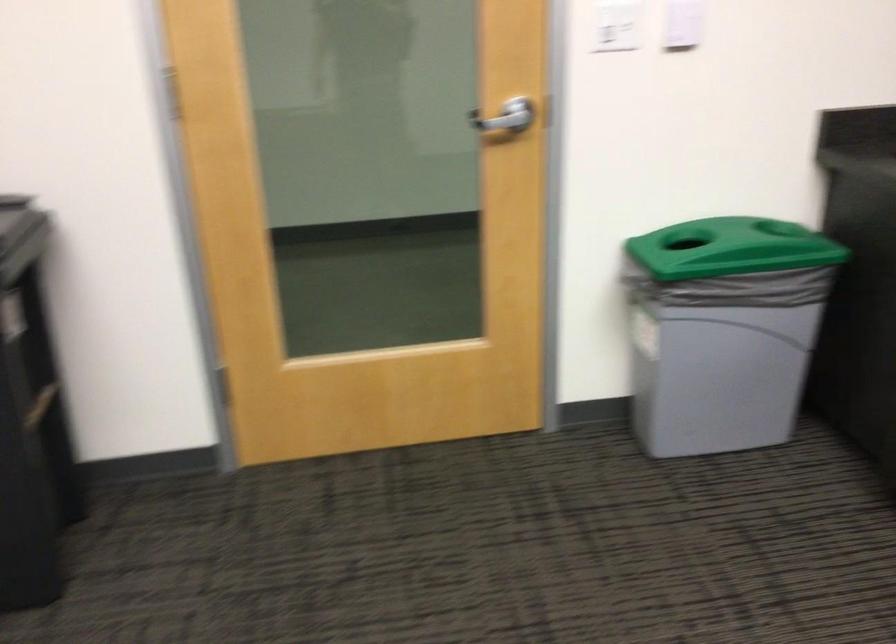
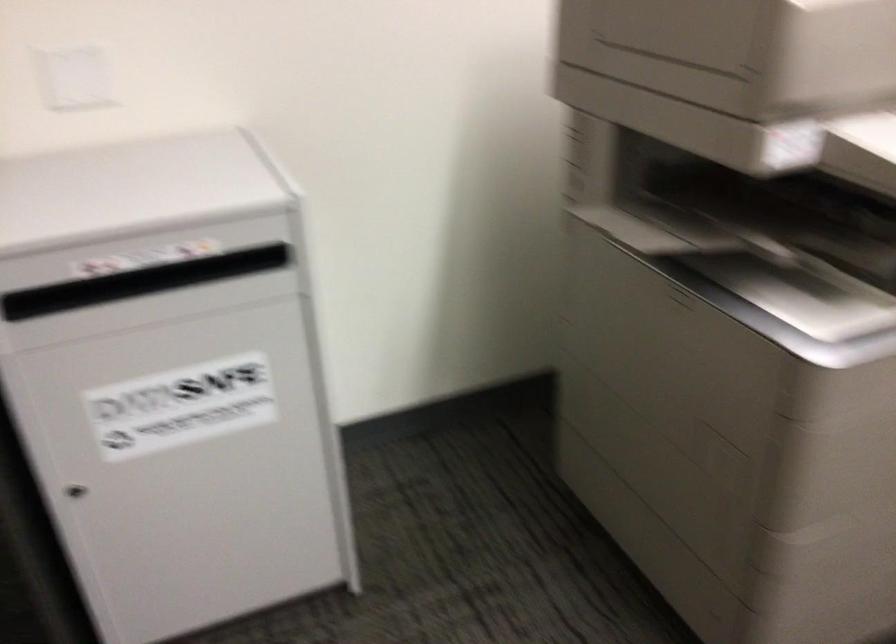
Based on the continuous images, in which direction is the camera rotating?

The camera's rotation is toward left-down.